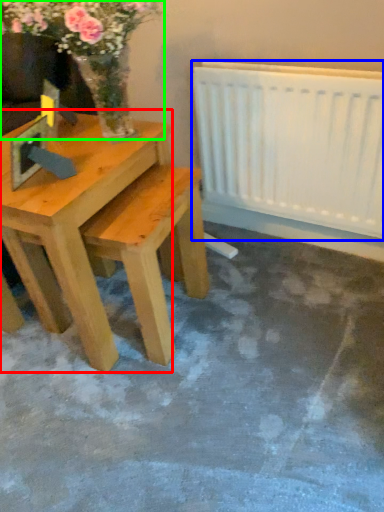
Question: Which object is the farthest from table (highlighted by a red box)? Choose among these: radiator (highlighted by a blue box) or floral arrangement (highlighted by a green box).

Choices:
 (A) radiator
 (B) floral arrangement

Answer: (A)